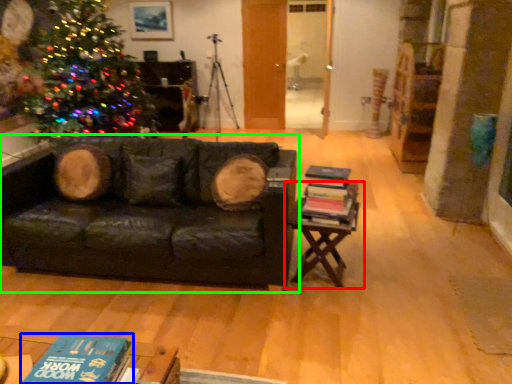
Question: Which object is positioned farthest from table (highlighted by a red box)? Select from book (highlighted by a blue box) and studio couch (highlighted by a green box).

Choices:
 (A) book
 (B) studio couch

Answer: (A)